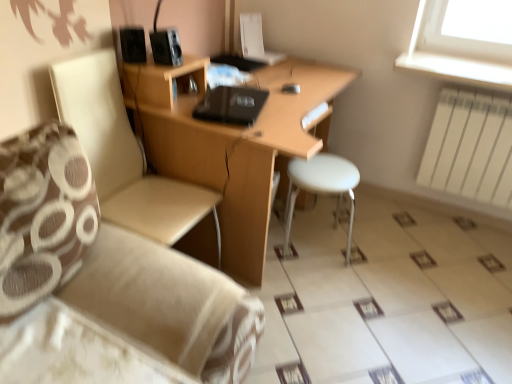
Question: Considering the relative sizes of beige fabric chair at left and white plastic stool at center in the image provided, is beige fabric chair at left shorter than white plastic stool at center?

Choices:
 (A) no
 (B) yes

Answer: (A)

Question: From the image's perspective, is beige fabric chair at left on white plastic stool at center?

Choices:
 (A) no
 (B) yes

Answer: (B)

Question: From the image's perspective, is beige fabric chair at left located beneath white plastic stool at center?

Choices:
 (A) no
 (B) yes

Answer: (A)

Question: Is the depth of beige fabric chair at left less than that of white plastic stool at center?

Choices:
 (A) yes
 (B) no

Answer: (A)

Question: Considering the relative sizes of beige fabric chair at left and white plastic stool at center in the image provided, is beige fabric chair at left taller than white plastic stool at center?

Choices:
 (A) no
 (B) yes

Answer: (B)

Question: Is beige fabric chair at left wider than white plastic stool at center?

Choices:
 (A) yes
 (B) no

Answer: (A)

Question: Considering the relative sizes of beige fabric couch at lower left and wooden desk at center in the image provided, is beige fabric couch at lower left shorter than wooden desk at center?

Choices:
 (A) yes
 (B) no

Answer: (A)

Question: Would you say beige fabric couch at lower left is a long distance from wooden desk at center?

Choices:
 (A) yes
 (B) no

Answer: (B)

Question: Can you confirm if beige fabric couch at lower left is wider than wooden desk at center?

Choices:
 (A) no
 (B) yes

Answer: (A)

Question: Does beige fabric couch at lower left come in front of wooden desk at center?

Choices:
 (A) yes
 (B) no

Answer: (A)

Question: From a real-world perspective, is beige fabric couch at lower left over wooden desk at center?

Choices:
 (A) yes
 (B) no

Answer: (B)

Question: Can you confirm if beige fabric couch at lower left is smaller than wooden desk at center?

Choices:
 (A) no
 (B) yes

Answer: (B)

Question: Is there a large distance between black matte speaker at upper left, which is the 2th speaker in right-to-left order, and white plastic stool at center?

Choices:
 (A) no
 (B) yes

Answer: (A)